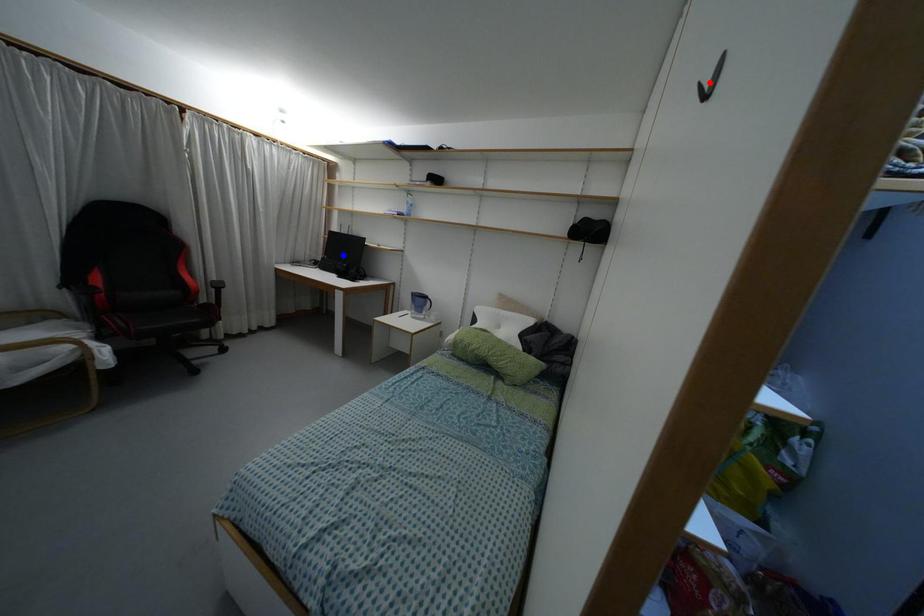
Question: Two points are marked on the image. Which point is closer to the camera?

Choices:
 (A) Blue point is closer.
 (B) Red point is closer.

Answer: (B)